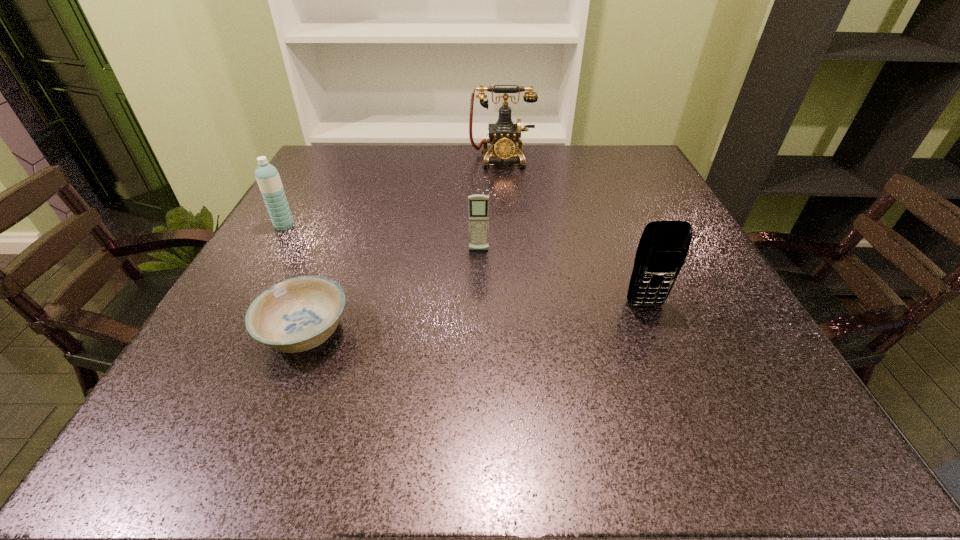
You are a GUI agent. You are given a task and a screenshot of the screen. Output one action in this format:
    pyautogui.click(x=<x>, y=<y>)
    Task: Click on the vacant point located between the third nearest object and the taller cellular telephone
    
    Given the screenshot: What is the action you would take?
    pyautogui.click(x=562, y=278)

The image size is (960, 540). Find the location of `empty space between the water bottle and the rightmost object`. empty space between the water bottle and the rightmost object is located at coordinates (465, 265).

I want to click on free space between the shortest object and the telephone, so click(x=403, y=246).

What are the coordinates of `vacant point located between the farthest object and the fourth nearest object` in the screenshot? It's located at (393, 192).

Identify which object is the second nearest to the shortest object. Please provide its 2D coordinates. Your answer should be formatted as a tuple, i.e. [(x, y)], where the tuple contains the x and y coordinates of a point satisfying the conditions above.

[(478, 205)]

Identify which object is the third closest to the bowl. Please provide its 2D coordinates. Your answer should be formatted as a tuple, i.e. [(x, y)], where the tuple contains the x and y coordinates of a point satisfying the conditions above.

[(663, 247)]